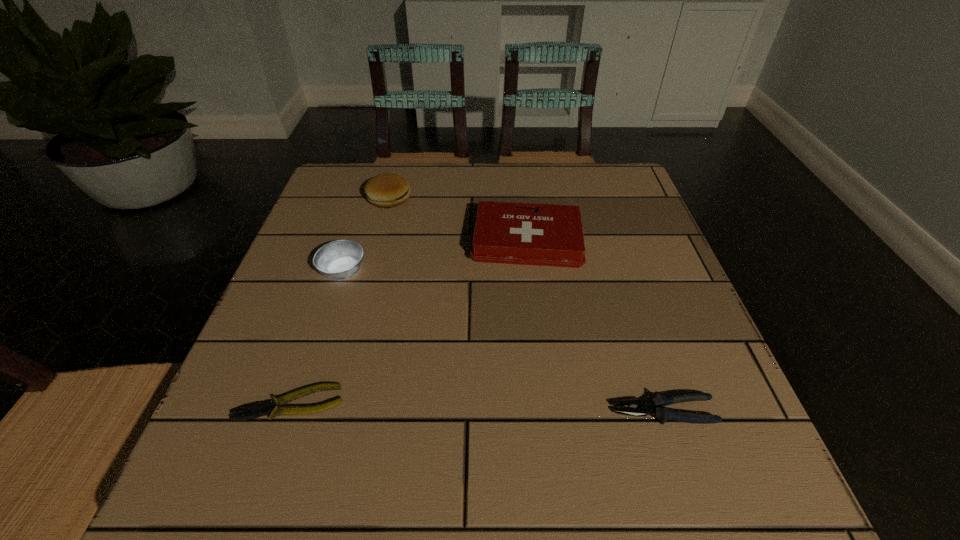
Image resolution: width=960 pixels, height=540 pixels. Find the location of `free point between the first-aid kit and the ashtray`. free point between the first-aid kit and the ashtray is located at coordinates (435, 256).

This screenshot has width=960, height=540. I want to click on vacant region between the patty and the shorter pliers, so click(x=340, y=301).

Identify the location of blank region between the taller pliers and the first-aid kit. Image resolution: width=960 pixels, height=540 pixels. (595, 326).

Where is `blank region between the ashtray and the taller pliers`? This screenshot has height=540, width=960. blank region between the ashtray and the taller pliers is located at coordinates (504, 341).

Identify the location of empty space that is in between the right pliers and the left pliers. (477, 407).

The height and width of the screenshot is (540, 960). I want to click on free space between the ashtray and the left pliers, so click(317, 338).

Image resolution: width=960 pixels, height=540 pixels. Identify the location of free space between the patty and the left pliers. (340, 301).

Where is `object identified as the second closest to the patty`? The width and height of the screenshot is (960, 540). object identified as the second closest to the patty is located at coordinates coord(339,260).

Select which object is the third closest to the left pliers. Please provide its 2D coordinates. Your answer should be formatted as a tuple, i.e. [(x, y)], where the tuple contains the x and y coordinates of a point satisfying the conditions above.

[(654, 406)]

The image size is (960, 540). Identify the location of free space that satisfies the following two spatial constraints: 1. on the back side of the shortest object; 2. on the right side of the ashtray. (335, 272).